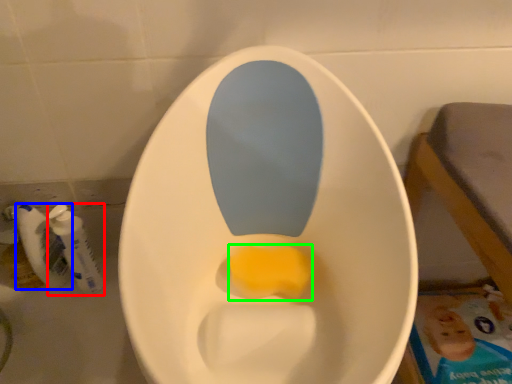
Question: Estimate the real-world distances between objects in this image. Which object is farther from mouthwash (highlighted by a red box), mouthwash (highlighted by a blue box) or food (highlighted by a green box)?

Choices:
 (A) mouthwash
 (B) food

Answer: (B)